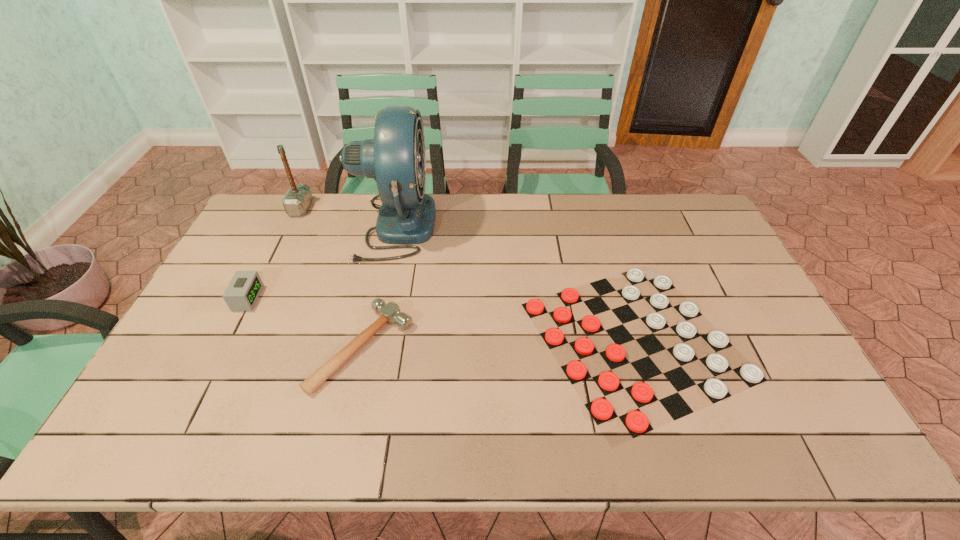
Where is `free space that satisfies the following two spatial constraints: 1. on the striking surface of the left hammer; 2. on the back side of the rightmost object`? The image size is (960, 540). free space that satisfies the following two spatial constraints: 1. on the striking surface of the left hammer; 2. on the back side of the rightmost object is located at coordinates (237, 340).

This screenshot has height=540, width=960. I want to click on free point that satisfies the following two spatial constraints: 1. on the back side of the second shortest object; 2. on the left side of the rightmost object, so click(x=365, y=340).

What are the coordinates of `free region that satisfies the following two spatial constraints: 1. on the striking surface of the second tallest object; 2. on the back side of the shortest object` in the screenshot? It's located at (237, 340).

Identify the location of free space that satisfies the following two spatial constraints: 1. on the back side of the rightmost object; 2. on the striking surface of the left hammer. This screenshot has height=540, width=960. (594, 208).

The width and height of the screenshot is (960, 540). I want to click on vacant space that satisfies the following two spatial constraints: 1. on the front-facing side of the third tallest object; 2. on the right side of the shorter hammer, so click(x=223, y=347).

The width and height of the screenshot is (960, 540). In order to click on free point that satisfies the following two spatial constraints: 1. in front of the checkerboard to blow air; 2. on the right side of the fan in this screenshot , I will do 370,340.

Where is `blank area in the image that satisfies the following two spatial constraints: 1. in front of the fan to blow air; 2. on the left side of the rightmost object`? blank area in the image that satisfies the following two spatial constraints: 1. in front of the fan to blow air; 2. on the left side of the rightmost object is located at coordinates (370, 340).